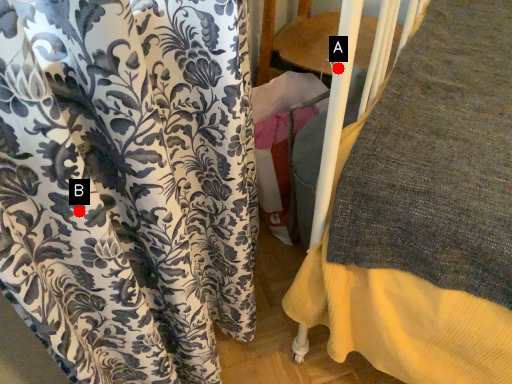
Question: Two points are circled on the image, labeled by A and B beside each circle. Which point is closer to the camera taking this photo?

Choices:
 (A) A is closer
 (B) B is closer

Answer: (B)